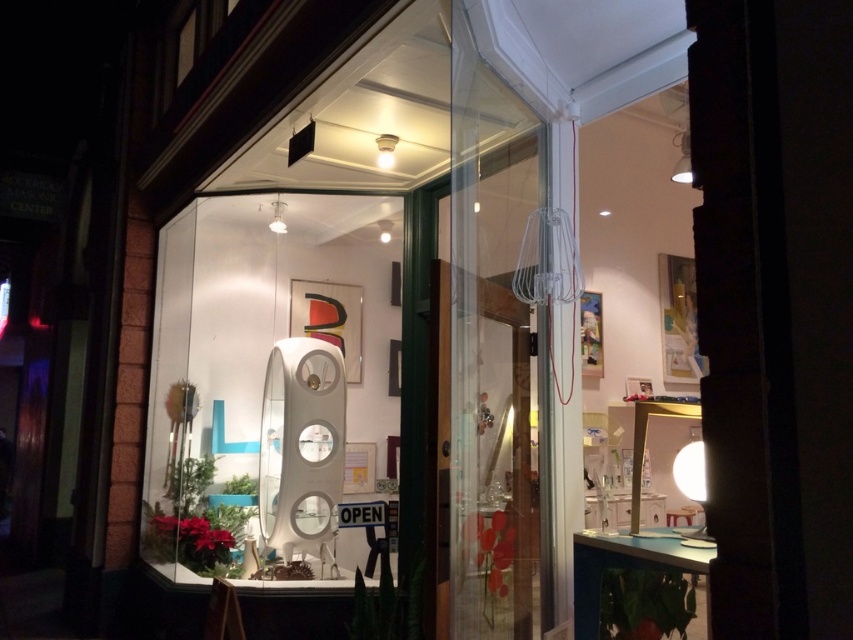
Who is shorter, white glossy mirror at center or transparent glass door at center?

With less height is transparent glass door at center.

This screenshot has width=853, height=640. What are the coordinates of `white glossy mirror at center` in the screenshot? It's located at [x=270, y=378].